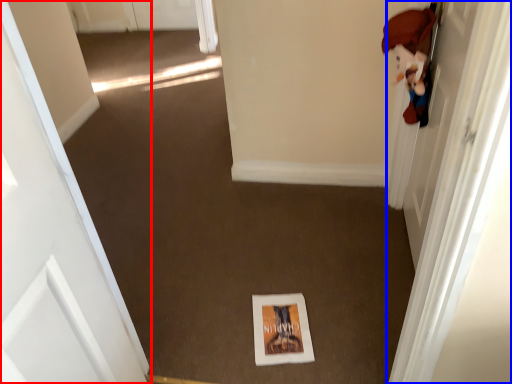
Question: Which object appears closest to the camera in this image, door (highlighted by a red box) or door (highlighted by a blue box)?

Choices:
 (A) door
 (B) door

Answer: (A)